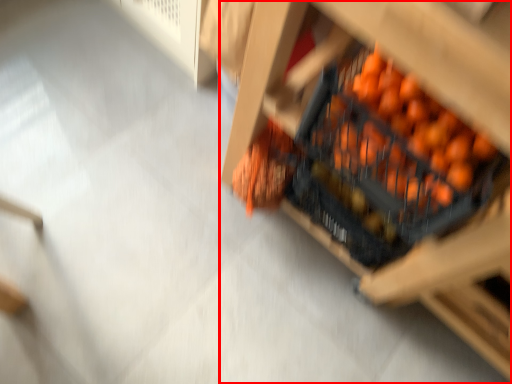
Question: In this image, where is furniture (annotated by the red box) located relative to fruit?

Choices:
 (A) right
 (B) left

Answer: (A)